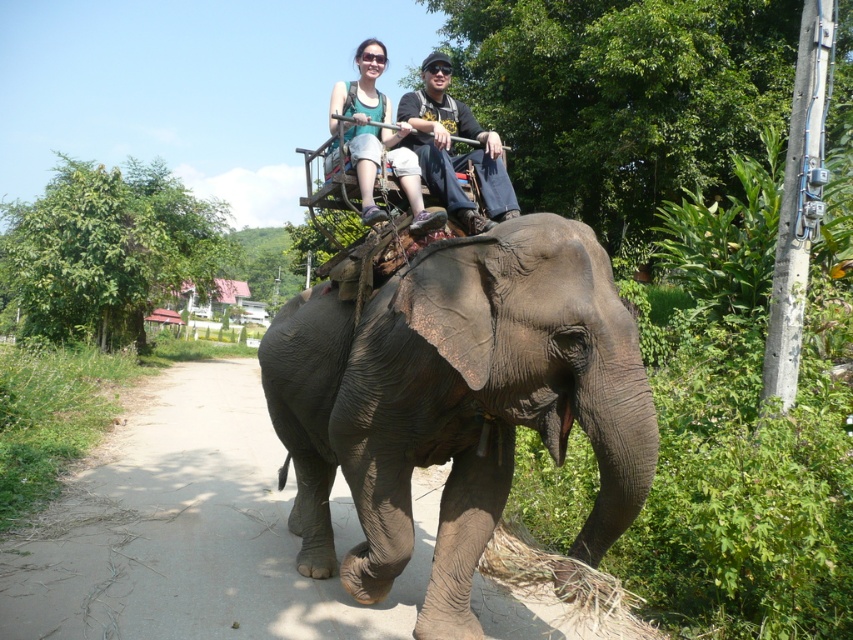
Can you confirm if gray textured elephant at center is bigger than matte black elephant at center?

Yes.

Looking at this image, who is taller, gray textured elephant at center or matte black elephant at center?

With more height is gray textured elephant at center.

The width and height of the screenshot is (853, 640). What are the coordinates of `gray textured elephant at center` in the screenshot? It's located at (457, 403).